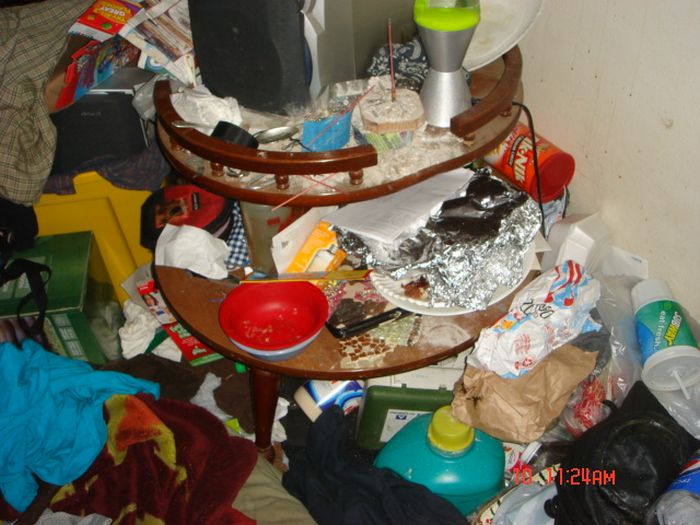
Where is `red bowl`? red bowl is located at coordinates (269, 311).